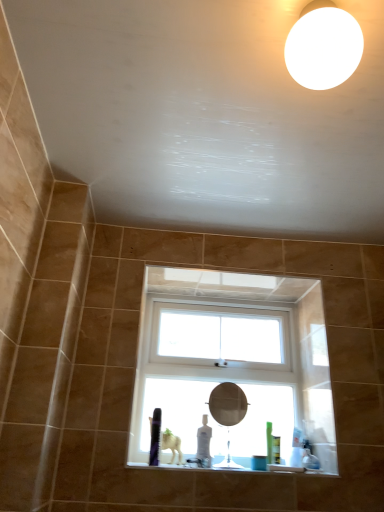
Question: Does point (342, 52) appear closer or farther from the camera than point (269, 314)?

Choices:
 (A) farther
 (B) closer

Answer: (B)

Question: From their relative heights in the image, would you say white matte light fixture at upper right is taller or shorter than white plastic window at center?

Choices:
 (A) tall
 (B) short

Answer: (B)

Question: Which of these objects is positioned closest to the white glossy window sill at lower center?

Choices:
 (A) white matte light fixture at upper right
 (B) white plastic window at center
 (C) matte silver mirror at center

Answer: (B)

Question: Which of these objects is positioned closest to the matte silver mirror at center?

Choices:
 (A) white glossy window sill at lower center
 (B) white plastic window at center
 (C) white matte light fixture at upper right

Answer: (B)